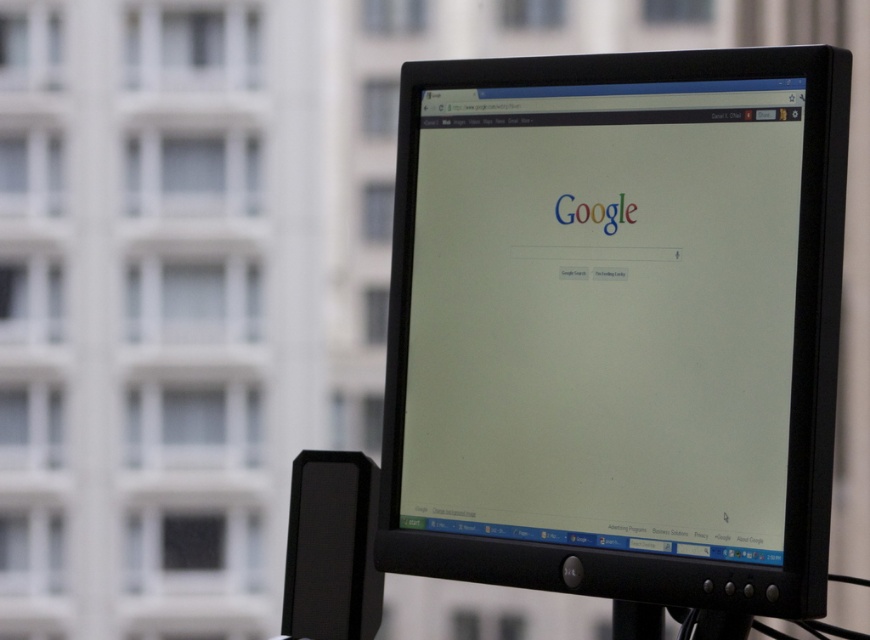
Question: Is the position of black plastic monitor at center more distant than that of black plastic pole at center?

Choices:
 (A) no
 (B) yes

Answer: (A)

Question: Does black plastic monitor at center have a larger size compared to black plastic pole at center?

Choices:
 (A) no
 (B) yes

Answer: (B)

Question: Which of the following is the farthest from the observer?

Choices:
 (A) black plastic monitor at center
 (B) black plastic pole at center

Answer: (B)

Question: Can you confirm if black plastic monitor at center is smaller than black plastic pole at center?

Choices:
 (A) yes
 (B) no

Answer: (B)

Question: Among these objects, which one is nearest to the camera?

Choices:
 (A) black plastic pole at center
 (B) black plastic monitor at center

Answer: (B)